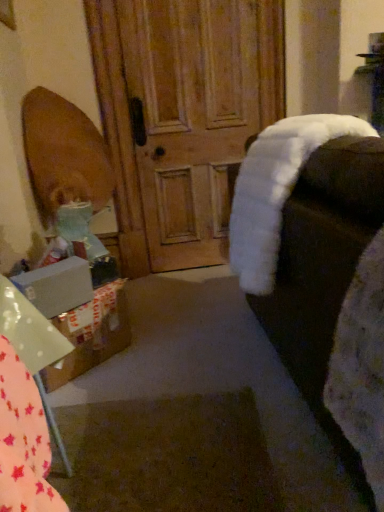
What are the coordinates of `free location in front of white cardboard box at lower left` in the screenshot? It's located at (94, 397).